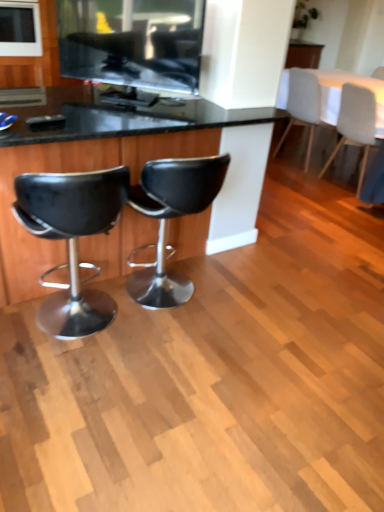
This screenshot has width=384, height=512. What are the coordinates of `vacant space underneath black leather stool at left, the fourth chair from the right (from a real-world perspective)` in the screenshot? It's located at (83, 334).